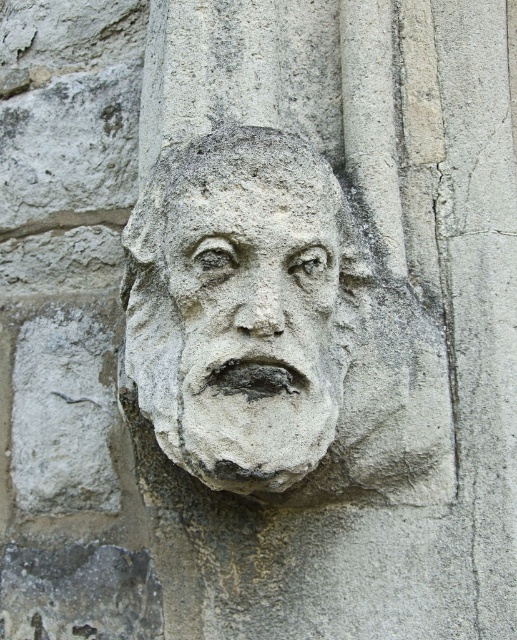
Is point (401, 323) positioned behind point (296, 440)?

Yes, point (401, 323) is behind point (296, 440).

Which of these two, stone face at center or stone textured face at center, stands taller?

Standing taller between the two is stone face at center.

Is point (443, 492) farther from camera compared to point (286, 380)?

That is True.

Where is `stone face at center`? stone face at center is located at coordinates pyautogui.click(x=279, y=332).